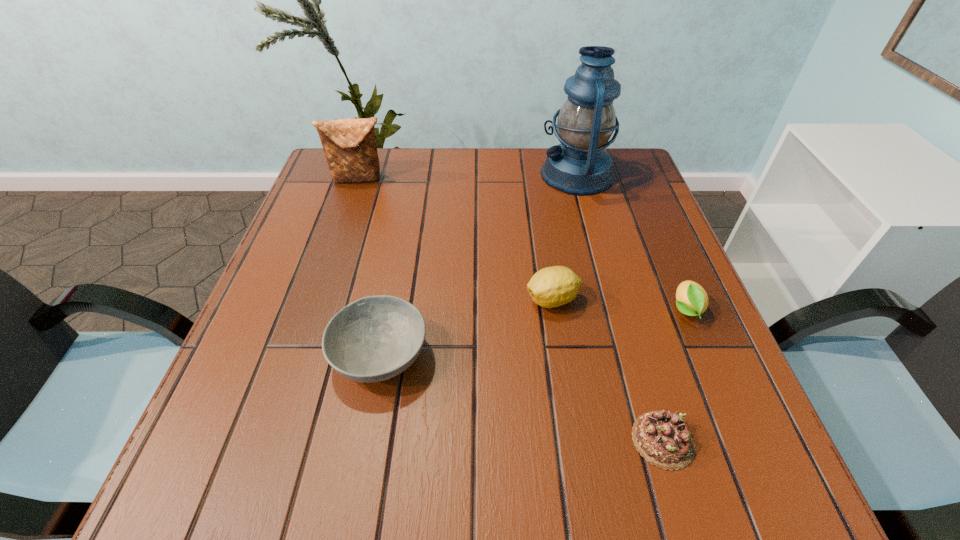
At what (x,y) coordinates should I click in order to perform the action: click on lantern. Please return your answer as a coordinate pair (x, y). Looking at the image, I should click on (580, 166).

The image size is (960, 540). I want to click on clutch bag, so click(349, 145).

Where is `the left lemon`? The height and width of the screenshot is (540, 960). the left lemon is located at coordinates (550, 287).

Where is `bowl`? The width and height of the screenshot is (960, 540). bowl is located at coordinates (375, 338).

This screenshot has width=960, height=540. What are the coordinates of `the rightmost object` in the screenshot? It's located at (691, 299).

Locate an element on the screen. The width and height of the screenshot is (960, 540). the right lemon is located at coordinates (691, 299).

The image size is (960, 540). Identify the location of the nearest object. (662, 438).

Identify the location of chocolate cake. The width and height of the screenshot is (960, 540). (662, 438).

Image resolution: width=960 pixels, height=540 pixels. I want to click on free space located on the face of the lantern, so click(x=435, y=174).

Find the location of `vacant space positioned 0.390m on the face of the lantern`. vacant space positioned 0.390m on the face of the lantern is located at coordinates click(x=398, y=174).